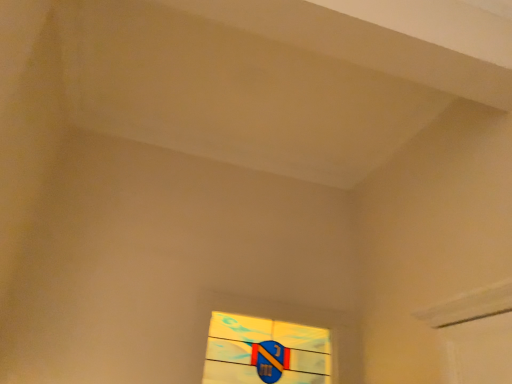
Where is `blue glass shield at center`? This screenshot has height=384, width=512. blue glass shield at center is located at coordinates (265, 352).

What do you see at coordinates (265, 352) in the screenshot? The height and width of the screenshot is (384, 512). I see `blue glass shield at center` at bounding box center [265, 352].

At what (x,y) coordinates should I click in order to perform the action: click on blue glass shield at center. Please return your answer as a coordinate pair (x, y). This screenshot has height=384, width=512. Looking at the image, I should click on (265, 352).